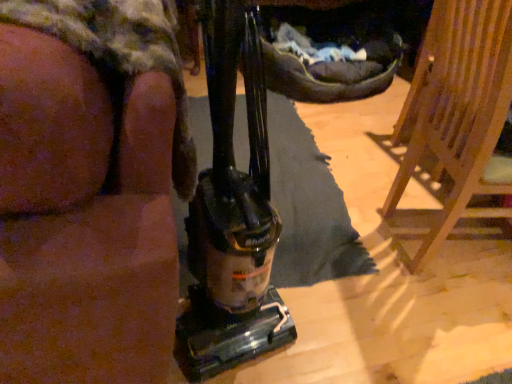
What do you see at coordinates (89, 192) in the screenshot? I see `brown fabric couch at left` at bounding box center [89, 192].

The image size is (512, 384). What are the coordinates of `brown fabric couch at left` in the screenshot? It's located at point(89,192).

This screenshot has height=384, width=512. Describe the element at coordinates (457, 119) in the screenshot. I see `wooden chair at right` at that location.

In order to click on wooden chair at right in this screenshot , I will do `click(457, 119)`.

The height and width of the screenshot is (384, 512). Identify the location of brown fabric couch at left. (89, 192).

Considering the positions of objects wooden chair at right and brown fabric couch at left in the image provided, who is more to the right, wooden chair at right or brown fabric couch at left?

wooden chair at right.

Is the position of wooden chair at right less distant than that of brown fabric couch at left?

No, wooden chair at right is further to the viewer.

Between point (433, 49) and point (100, 12), which one is positioned in front?

The point (100, 12) is closer to the camera.

From the image's perspective, is wooden chair at right located beneath brown fabric couch at left?

Correct, wooden chair at right appears lower than brown fabric couch at left in the image.

From a real-world perspective, is wooden chair at right physically below brown fabric couch at left?

Yes.

Which of these two, wooden chair at right or brown fabric couch at left, is thinner?

wooden chair at right is thinner.

From their relative heights in the image, would you say wooden chair at right is taller or shorter than brown fabric couch at left?

Considering their sizes, wooden chair at right has less height than brown fabric couch at left.

Looking at the image, does wooden chair at right seem bigger or smaller compared to brown fabric couch at left?

Considering their sizes, wooden chair at right takes up less space than brown fabric couch at left.

Is brown fabric couch at left completely or partially inside wooden chair at right?

That's incorrect, brown fabric couch at left is not inside wooden chair at right.

Are wooden chair at right and brown fabric couch at left located far from each other?

wooden chair at right is near brown fabric couch at left, not far away.

Could you tell me if wooden chair at right is turned towards brown fabric couch at left?

No, wooden chair at right does not turn towards brown fabric couch at left.

Locate an element on the screen. This screenshot has height=384, width=512. furniture behind the brown fabric couch at left is located at coordinates (457, 119).

Is brown fabric couch at left at the left side of wooden chair at right?

Indeed, brown fabric couch at left is positioned on the left side of wooden chair at right.

Does brown fabric couch at left come in front of wooden chair at right?

Yes, brown fabric couch at left is closer to the viewer.

Considering the positions of point (101, 179) and point (449, 222), is point (101, 179) closer or farther from the camera than point (449, 222)?

Clearly, point (101, 179) is closer to the camera than point (449, 222).

From the image's perspective, is brown fabric couch at left above or below wooden chair at right?

brown fabric couch at left is situated higher than wooden chair at right in the image.

From a real-world perspective, is brown fabric couch at left physically located above or below wooden chair at right?

brown fabric couch at left is situated higher than wooden chair at right in the real world.

Looking at their sizes, would you say brown fabric couch at left is wider or thinner than wooden chair at right?

In the image, brown fabric couch at left appears to be wider than wooden chair at right.

Which of these two, brown fabric couch at left or wooden chair at right, stands shorter?

Standing shorter between the two is wooden chair at right.

In the scene shown: Considering the sizes of objects brown fabric couch at left and wooden chair at right in the image provided, who is bigger, brown fabric couch at left or wooden chair at right?

Bigger between the two is brown fabric couch at left.

Would you say brown fabric couch at left is inside or outside wooden chair at right?

brown fabric couch at left is outside wooden chair at right.

Is brown fabric couch at left directly adjacent to wooden chair at right?

There is a gap between brown fabric couch at left and wooden chair at right.

Is brown fabric couch at left oriented towards wooden chair at right?

No, brown fabric couch at left is not facing towards wooden chair at right.

What's the angular difference between brown fabric couch at left and wooden chair at right's facing directions?

The angle between the facing direction of brown fabric couch at left and the facing direction of wooden chair at right is 174 degrees.

Identify the location of furniture below the brown fabric couch at left (from the image's perspective). [457, 119].

Find the location of a particular element. The image size is (512, 384). person in front of the wooden chair at right is located at coordinates (89, 192).

Find the location of a particular element. This screenshot has height=384, width=512. person that is on the left side of wooden chair at right is located at coordinates (89, 192).